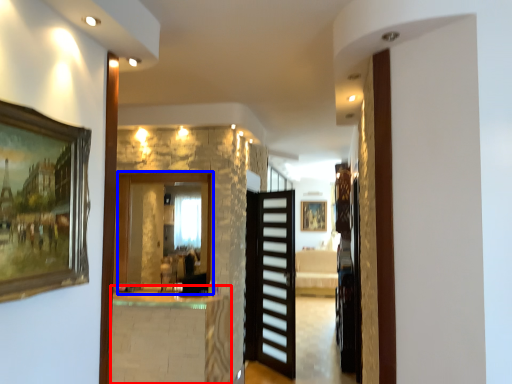
Question: Which of the following is the farthest to the observer, table (highlighted by a red box) or mirror (highlighted by a blue box)?

Choices:
 (A) table
 (B) mirror

Answer: (B)